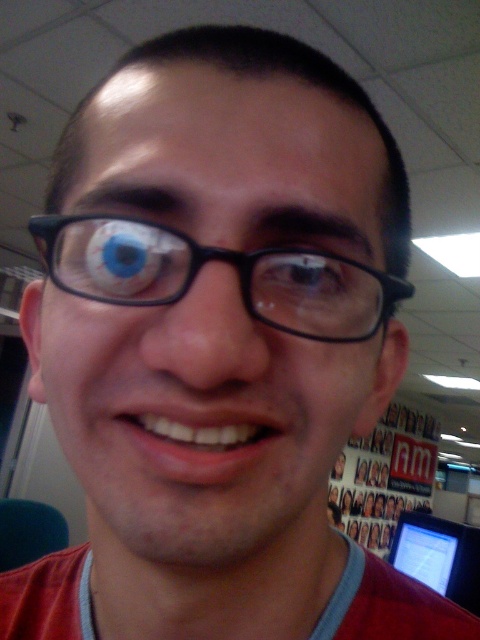
You are a photographer setting up a shot of the person in the image. The matte plastic computer screen at lower right is in the frame. To ensure the screen is not in the center of the photo, where should you position the camera? Please provide coordinates in the format x,y where x and y range from 0 to 1. The center of the image is at 0.5,0.5.

The matte plastic computer screen at lower right is located at coordinates (439, 556). To keep it out of the center, position the camera away from this point. A safe position would be around (240, 192) to ensure the screen remains off center.